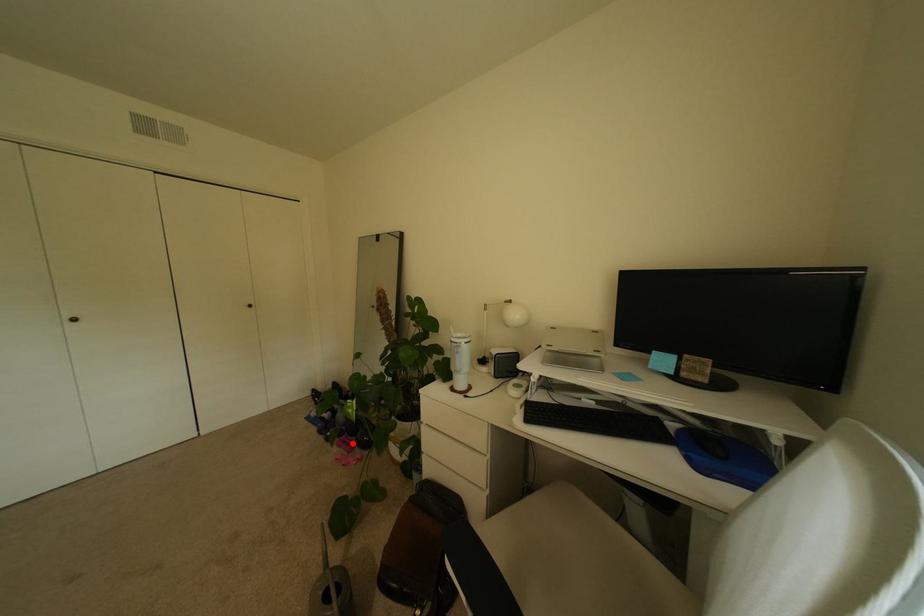
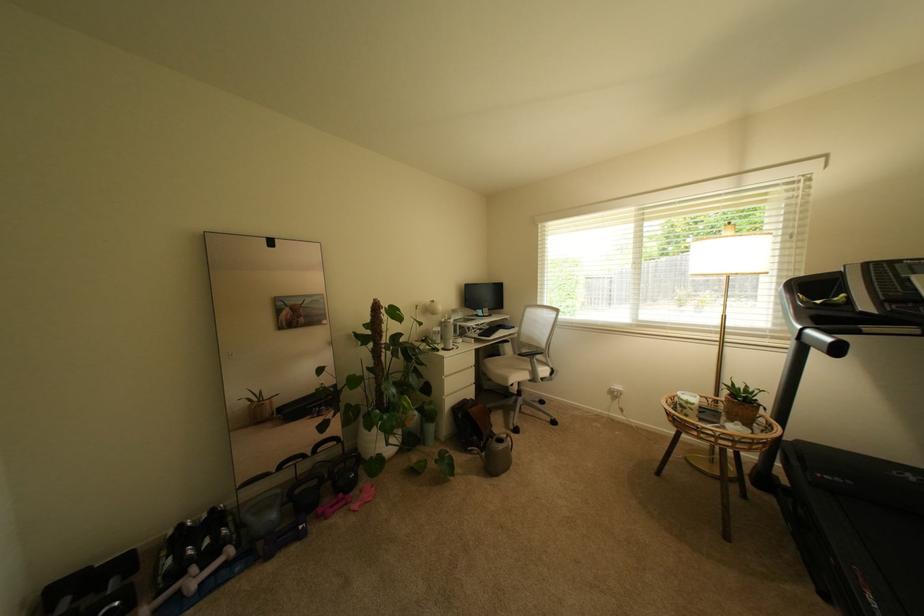
The point at the highlighted location is marked in the first image. Where is the corresponding point in the second image?

(339, 508)